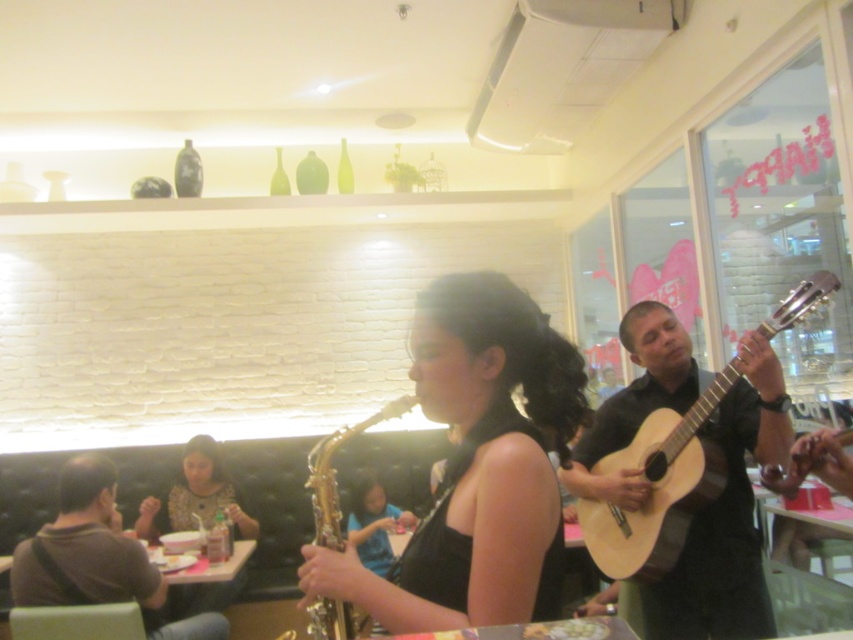
Question: Is light wood acoustic guitar at right to the left of gold metallic saxophone at center from the viewer's perspective?

Choices:
 (A) no
 (B) yes

Answer: (A)

Question: Which of these objects is positioned closest to the gold shiny saxophone at center?

Choices:
 (A) light wood acoustic guitar at right
 (B) matte black dress at center
 (C) gold metallic saxophone at center
 (D) brown fabric shirt at lower left

Answer: (C)

Question: Is brown fabric shirt at lower left bigger than matte black dress at center?

Choices:
 (A) yes
 (B) no

Answer: (B)

Question: Is light wood acoustic guitar at right smaller than matte black dress at center?

Choices:
 (A) no
 (B) yes

Answer: (B)

Question: Which point appears closest to the camera in this image?

Choices:
 (A) (312, 477)
 (B) (175, 593)
 (C) (62, 600)
 (D) (500, 458)

Answer: (D)

Question: Which point is farther to the camera?

Choices:
 (A) gold shiny saxophone at center
 (B) matte black dress at center

Answer: (B)